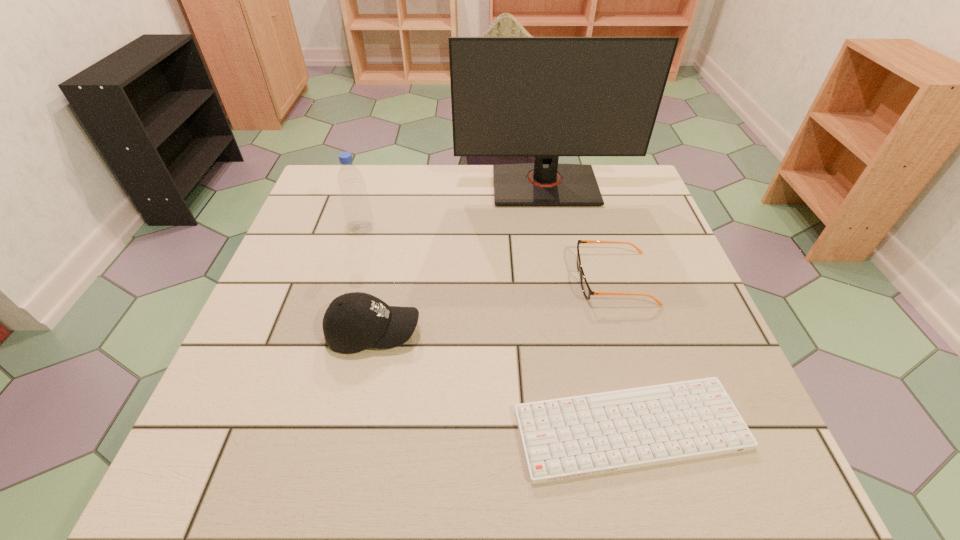
Find the location of `the tallest object`. the tallest object is located at coordinates tap(546, 97).

This screenshot has width=960, height=540. I want to click on monitor, so [x=546, y=97].

Identify the location of the second farthest object. (359, 218).

Locate an element on the screen. the fourth shortest object is located at coordinates (359, 218).

What are the coordinates of `the second nearest object` in the screenshot? It's located at (353, 322).

Identify the location of the third tallest object. This screenshot has width=960, height=540. (353, 322).

The height and width of the screenshot is (540, 960). I want to click on spectacles, so click(x=587, y=291).

This screenshot has width=960, height=540. In order to click on the second shortest object in this screenshot , I will do pyautogui.click(x=587, y=291).

In order to click on the shortest object in this screenshot , I will do `click(564, 438)`.

What are the coordinates of `the nearest object` in the screenshot? It's located at (564, 438).